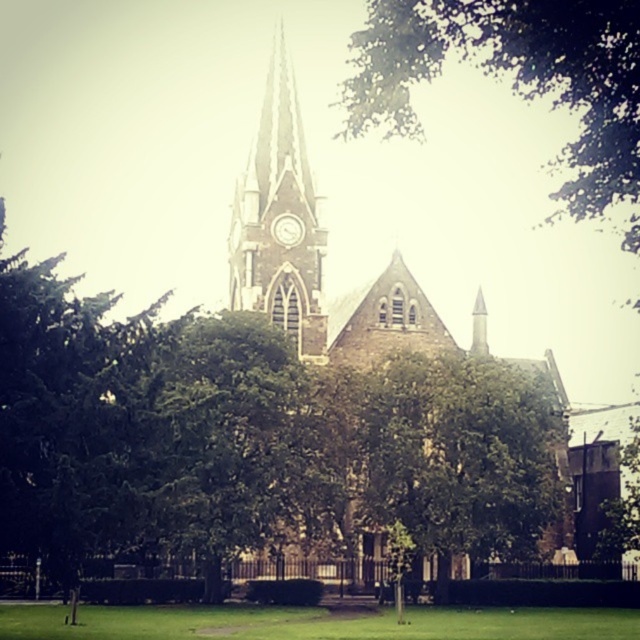
You are standing at the point marked with coordinates point (324, 259) in the image. Based on the scene, what structure are you directly facing?

The point (324, 259) corresponds to the brown stone church at center, so you are directly facing the brown stone church at center.

Looking at this image, you are standing in front of the brown stone church at center and want to take a photo of the dark brown stone clock tower at center. Which object is closer to you, making it appear larger in the photo?

The brown stone church at center is closer to you than the dark brown stone clock tower at center, so it will appear larger in the photo.